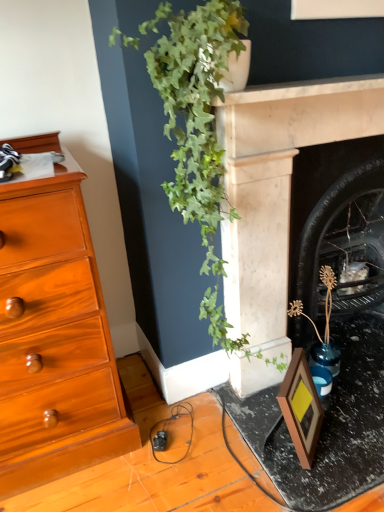
Identify the location of free space underneath wooden picture frame at lower right (from a real-world perspective). (286, 435).